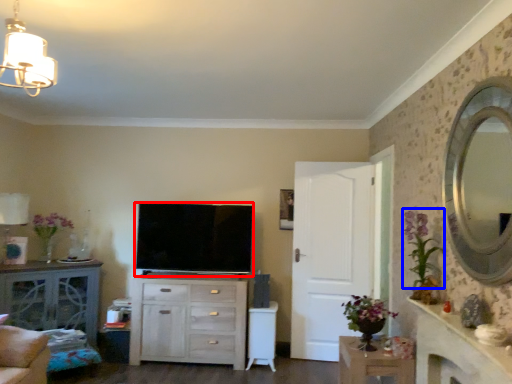
Question: Which of the following is the closest to the observer, television (highlighted by a red box) or floral arrangement (highlighted by a blue box)?

Choices:
 (A) television
 (B) floral arrangement

Answer: (B)